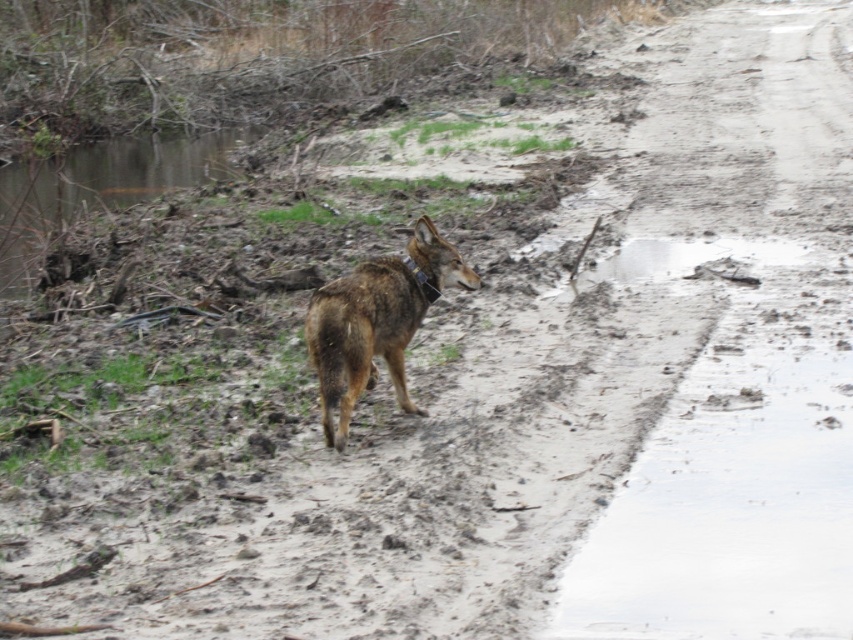
Does point (322, 369) lie behind point (56, 208)?

That is False.

Is brown fur dog at center to the right of brown muddy water at upper left from the viewer's perspective?

Indeed, brown fur dog at center is positioned on the right side of brown muddy water at upper left.

Where is `brown fur dog at center`? The width and height of the screenshot is (853, 640). brown fur dog at center is located at coordinates pos(376,321).

The height and width of the screenshot is (640, 853). Find the location of `brown fur dog at center`. brown fur dog at center is located at coordinates (376, 321).